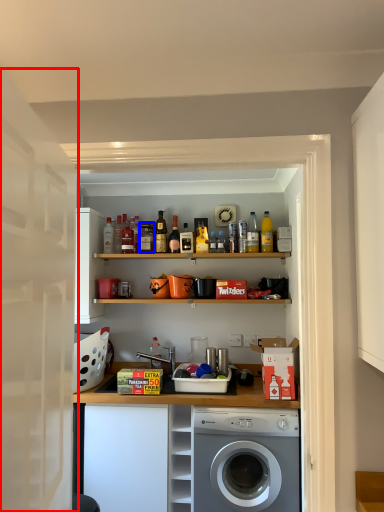
Question: Which object appears closest to the camera in this image, door (highlighted by a red box) or bottle (highlighted by a blue box)?

Choices:
 (A) door
 (B) bottle

Answer: (A)